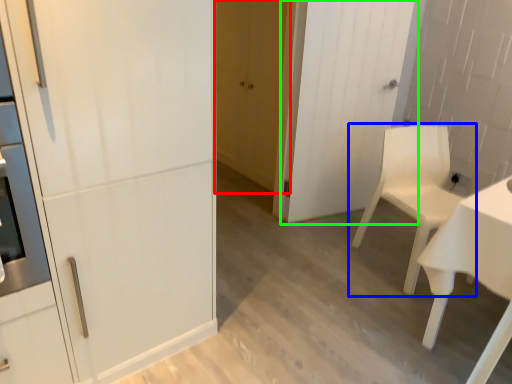
Question: Based on their relative distances, which object is nearer to door (highlighted by a red box)? Choose from chair (highlighted by a blue box) and door (highlighted by a green box).

Choices:
 (A) chair
 (B) door

Answer: (B)